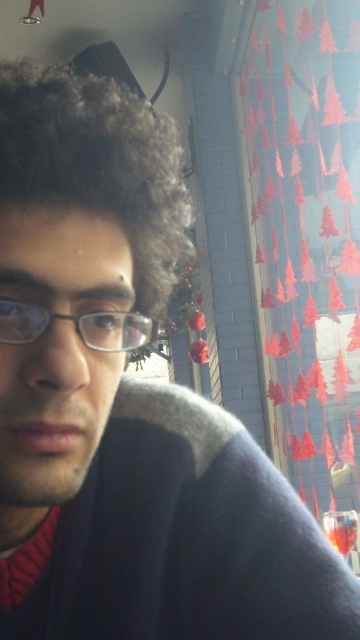
Question: Which point is farther to the camera?

Choices:
 (A) matte black glasses at center
 (B) fuzzy brown hair at upper left

Answer: (B)

Question: Can you confirm if fuzzy brown hair at upper left is positioned above matte black glasses at center?

Choices:
 (A) no
 (B) yes

Answer: (B)

Question: Is fuzzy brown hair at upper left positioned behind matte black glasses at center?

Choices:
 (A) yes
 (B) no

Answer: (A)

Question: In this image, where is fuzzy brown hair at upper left located relative to matte black glasses at center?

Choices:
 (A) above
 (B) below

Answer: (A)